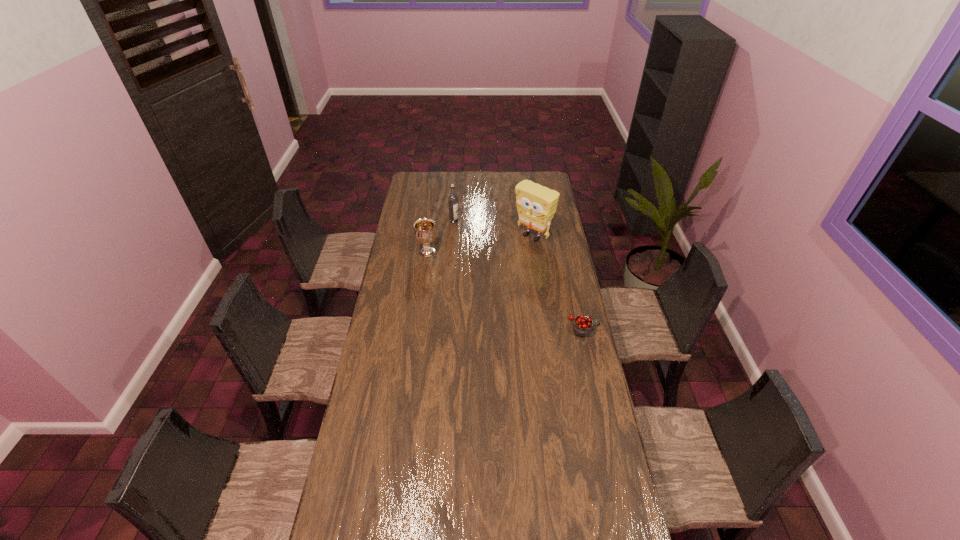
The width and height of the screenshot is (960, 540). I want to click on vacant space that is in between the farthest object and the sponge, so click(x=493, y=228).

Identify which object is located as the nearest to the third tallest object. Please provide its 2D coordinates. Your answer should be formatted as a tuple, i.e. [(x, y)], where the tuple contains the x and y coordinates of a point satisfying the conditions above.

[(452, 200)]

Identify the location of the closest object to the second tallest object. Image resolution: width=960 pixels, height=540 pixels. (425, 233).

Identify the location of blank space that satisfies the following two spatial constraints: 1. on the front side of the third object from right to left; 2. on the handle side of the nearest object. (446, 328).

In order to click on vacant position in the image that satisfies the following two spatial constraints: 1. on the front side of the sponge; 2. on the handle side of the pot filled with cherries in this screenshot , I will do `click(545, 328)`.